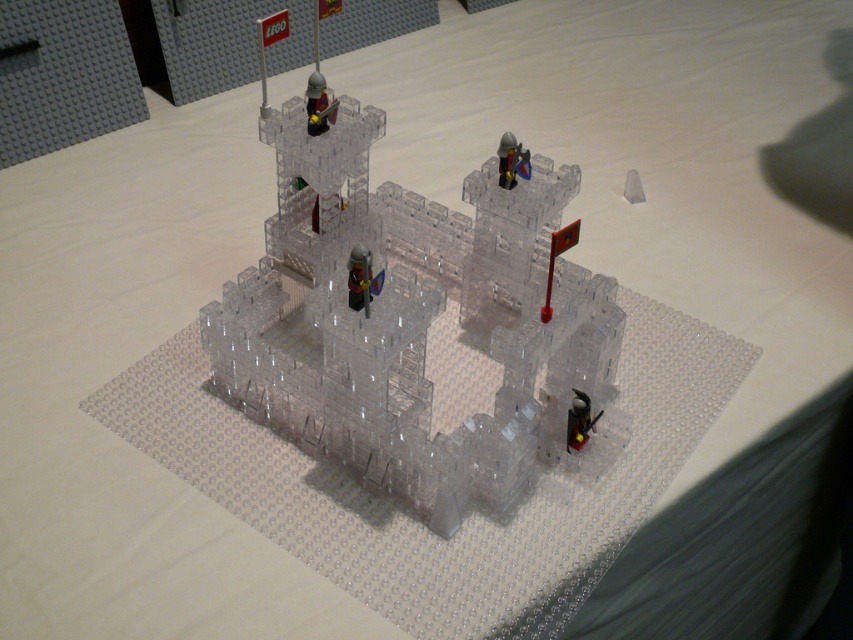
Is transparent plastic castle at center closer to camera compared to transparent plastic figure at center?

No, transparent plastic castle at center is further to the viewer.

Which is behind, point (527, 339) or point (368, 291)?

The point (527, 339) is behind.

Where is `transparent plastic castle at center`? The image size is (853, 640). transparent plastic castle at center is located at coordinates (410, 321).

Is transparent plastic castle at center wider than transparent plastic figure at lower right?

Yes, transparent plastic castle at center is wider than transparent plastic figure at lower right.

Is transparent plastic castle at center shorter than transparent plastic figure at lower right?

No, transparent plastic castle at center is not shorter than transparent plastic figure at lower right.

You are a GUI agent. You are given a task and a screenshot of the screen. Output one action in this format:
    pyautogui.click(x=<x>, y=<y>)
    Task: Click on the transparent plastic castle at center
    The image size is (853, 640).
    Given the screenshot: What is the action you would take?
    pyautogui.click(x=410, y=321)

Locate an element on the screen. Image resolution: width=853 pixels, height=640 pixels. transparent plastic castle at center is located at coordinates (410, 321).

Is transparent plastic figure at center positioned behind transparent plastic figure at lower right?

That is False.

Can you confirm if transparent plastic figure at center is positioned to the right of transparent plastic figure at lower right?

No, transparent plastic figure at center is not to the right of transparent plastic figure at lower right.

What do you see at coordinates (361, 278) in the screenshot? This screenshot has height=640, width=853. I see `transparent plastic figure at center` at bounding box center [361, 278].

Locate an element on the screen. transparent plastic figure at center is located at coordinates (361, 278).